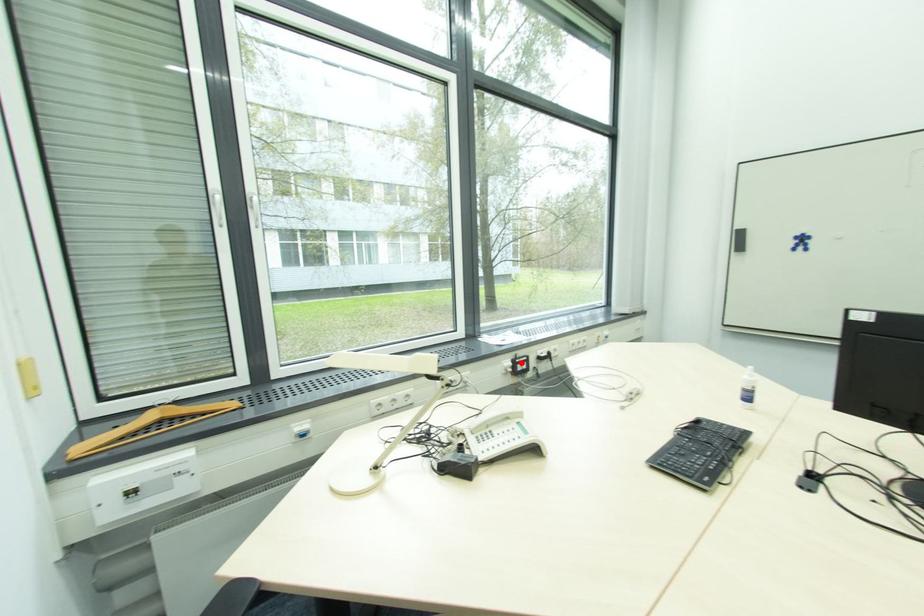
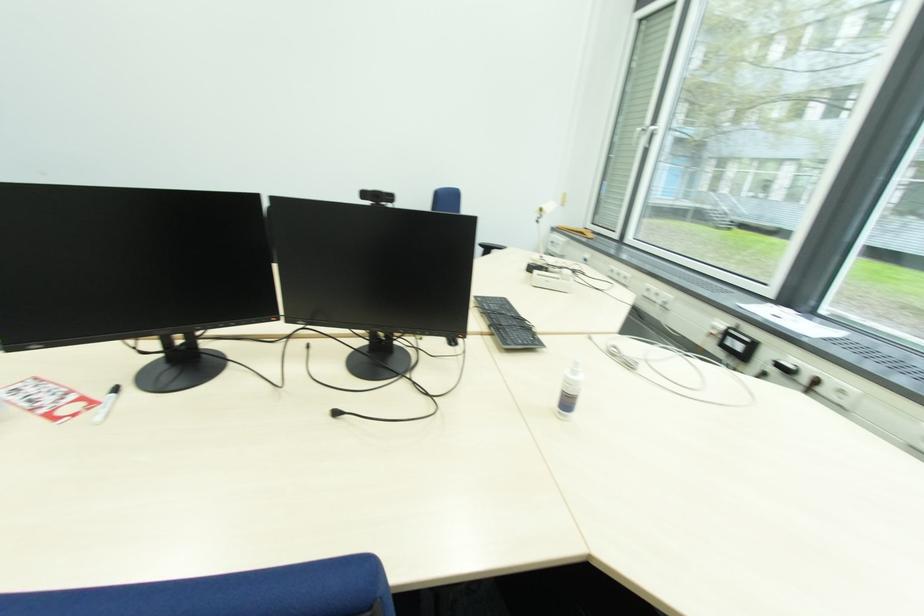
Locate, in the second image, the point that corresponds to the highlighted location in the first image.

(734, 333)